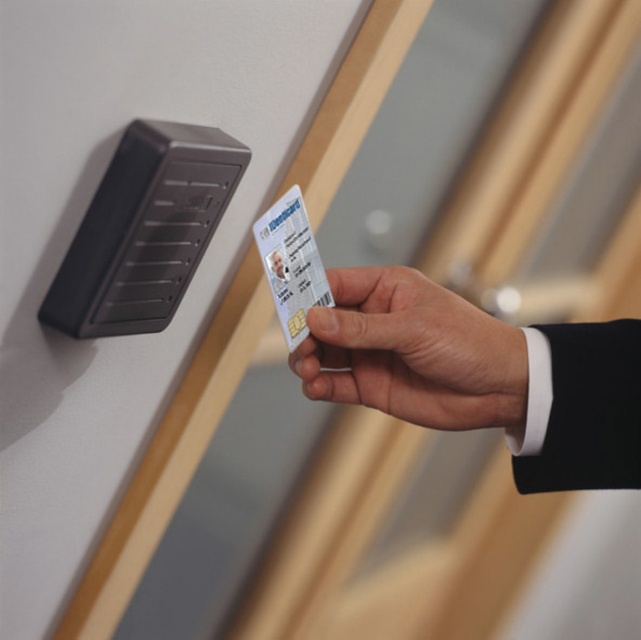
You are standing in front of a security access device. You need to place your card at point [401,348] to activate it. If your arm can reach up to 20 inches, will you be able to reach that point?

The distance between point [401,348] and the camera is 21.38 inches. Since your arm can only reach up to 20 inches, you will not be able to reach that point.

You are trying to insert the white matte id card at center into the black plastic lock at upper left. Will the card fit into the lock?

The white matte id card at center is bigger than the black plastic lock at upper left, so it will not fit into the lock.